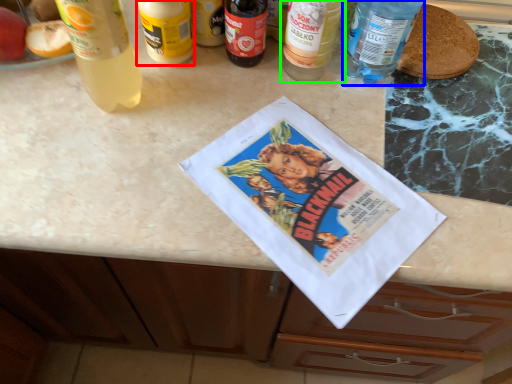
Question: Which object is positioned closest to bottle (highlighted by a red box)? Select from bottle (highlighted by a blue box) and bottle (highlighted by a green box).

Choices:
 (A) bottle
 (B) bottle

Answer: (B)